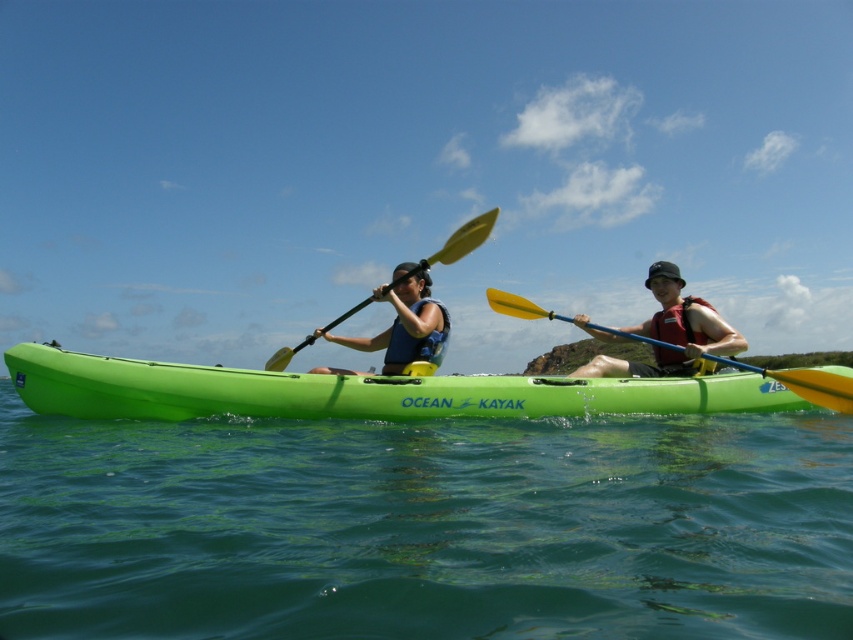
Who is positioned more to the left, green water at center or yellow plastic paddle at right?

green water at center

Measure the distance between point (416, 593) and camera.

3.20 meters

You are a GUI agent. You are given a task and a screenshot of the screen. Output one action in this format:
    pyautogui.click(x=<x>, y=<y>)
    Task: Click on the green water at center
    The image size is (853, 640).
    Given the screenshot: What is the action you would take?
    pyautogui.click(x=425, y=525)

Is matte blue life vest at center taller than yellow matte paddle at center?

No, matte blue life vest at center is not taller than yellow matte paddle at center.

Can you confirm if matte blue life vest at center is shorter than yellow matte paddle at center?

Indeed, matte blue life vest at center has a lesser height compared to yellow matte paddle at center.

Does point (689, 349) come in front of point (483, 221)?

That is False.

I want to click on matte blue life vest at center, so click(x=671, y=332).

Which of these two, green water at center or yellow matte paddle at center, stands shorter?

Standing shorter between the two is green water at center.

Which is below, green water at center or yellow matte paddle at center?

Positioned lower is green water at center.

The width and height of the screenshot is (853, 640). I want to click on green water at center, so click(425, 525).